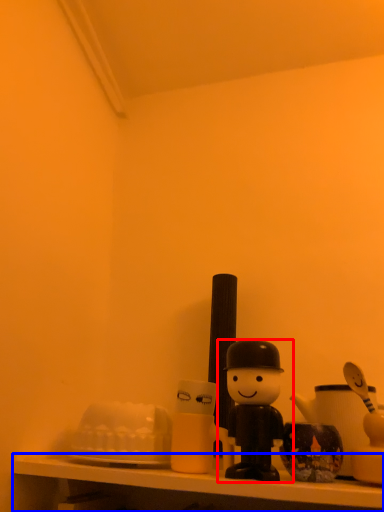
Question: Which of the following is the closest to the observer, toy (highlighted by a red box) or shelf (highlighted by a blue box)?

Choices:
 (A) toy
 (B) shelf

Answer: (B)